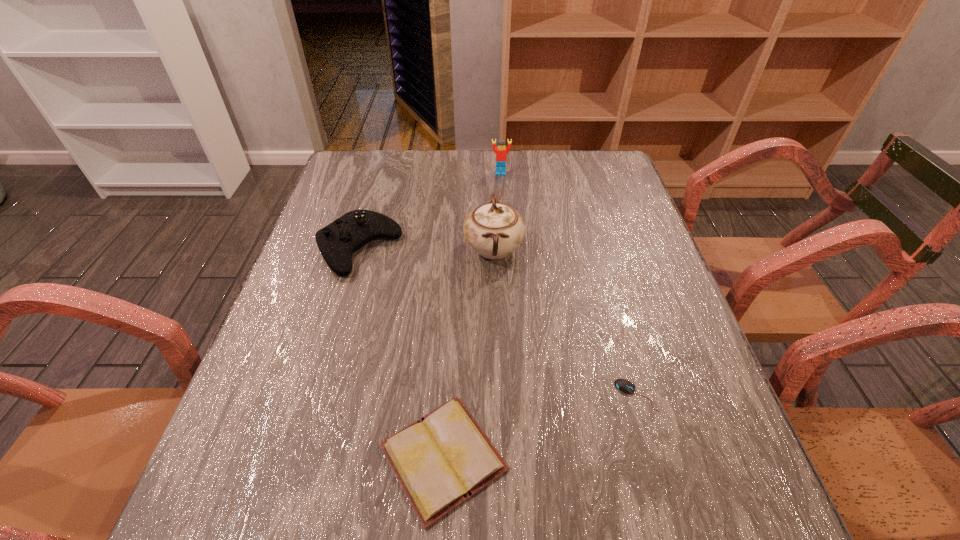
At what (x,y) coordinates should I click in order to perform the action: click on the tallest object. Please return your answer as a coordinate pair (x, y). Looking at the image, I should click on (493, 229).

Locate an element on the screen. the farthest object is located at coordinates (501, 157).

Locate an element on the screen. Image resolution: width=960 pixels, height=540 pixels. the fourth shortest object is located at coordinates (501, 157).

You are a GUI agent. You are given a task and a screenshot of the screen. Output one action in this format:
    pyautogui.click(x=<x>, y=<y>)
    Task: Click on the control
    Image resolution: width=960 pixels, height=540 pixels.
    Given the screenshot: What is the action you would take?
    pyautogui.click(x=337, y=242)

You are a GUI agent. You are given a task and a screenshot of the screen. Output one action in this format:
    pyautogui.click(x=<x>, y=<y>)
    Task: Click on the leftmost object
    
    Given the screenshot: What is the action you would take?
    pyautogui.click(x=337, y=242)

Where is `the second shortest object`? This screenshot has height=540, width=960. the second shortest object is located at coordinates (443, 459).

You are a GUI agent. You are given a task and a screenshot of the screen. Output one action in this format:
    pyautogui.click(x=<x>, y=<y>)
    Task: Click on the shortest object
    
    Given the screenshot: What is the action you would take?
    pyautogui.click(x=624, y=385)

This screenshot has height=540, width=960. Find the location of `the rightmost object`. the rightmost object is located at coordinates (624, 385).

Where is `blank area located 0.240m on the front of the chinaware`? The image size is (960, 540). blank area located 0.240m on the front of the chinaware is located at coordinates (497, 361).

At what (x,y) coordinates should I click in order to perform the action: click on free space located 0.050m on the face of the Lego. Please return your answer as a coordinate pair (x, y). Looking at the image, I should click on (501, 184).